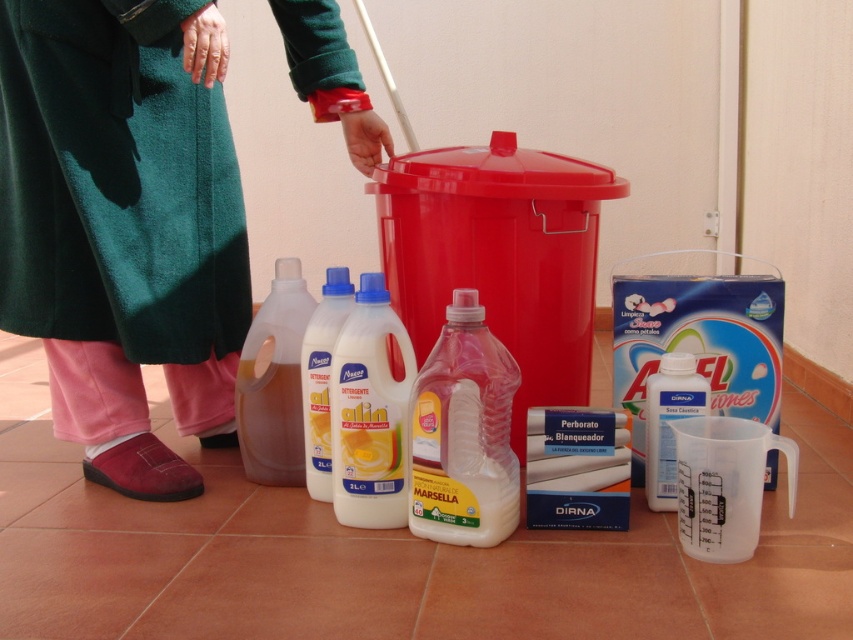
Question: Does green towel at left have a greater width compared to translucent plastic bottle at lower left?

Choices:
 (A) no
 (B) yes

Answer: (B)

Question: Does green towel at left appear under translucent plastic bottle at lower left?

Choices:
 (A) yes
 (B) no

Answer: (B)

Question: Estimate the real-world distances between objects in this image. Which object is farther from the pink translucent bottle at center?

Choices:
 (A) translucent plastic bottle at lower left
 (B) transparent plastic bottle at lower right
 (C) green towel at left

Answer: (C)

Question: Which point is closer to the camera?

Choices:
 (A) pink translucent bottle at center
 (B) white plastic bottles at center

Answer: (A)

Question: Does translucent plastic bottle at lower left appear over transparent plastic bottle at lower right?

Choices:
 (A) no
 (B) yes

Answer: (B)

Question: Which point is farther from the camera taking this photo?

Choices:
 (A) (345, 292)
 (B) (148, 355)
 (C) (647, 506)
 (D) (277, 304)

Answer: (D)